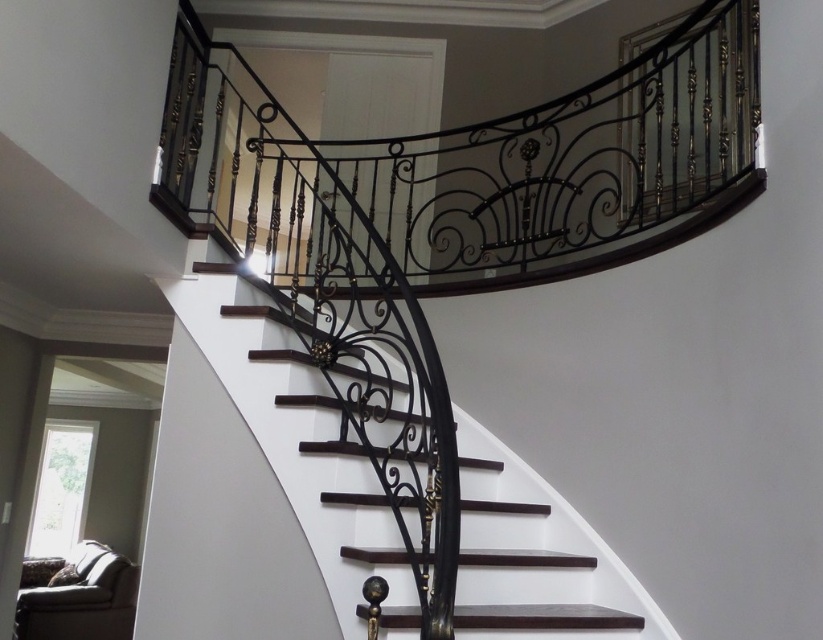
Question: Does black wrought iron balustrade at upper center come behind dark wood stairs at center?

Choices:
 (A) yes
 (B) no

Answer: (A)

Question: Does black wrought iron balustrade at upper center have a greater width compared to dark wood stairs at center?

Choices:
 (A) no
 (B) yes

Answer: (B)

Question: Is black wrought iron balustrade at upper center bigger than dark wood stairs at center?

Choices:
 (A) no
 (B) yes

Answer: (B)